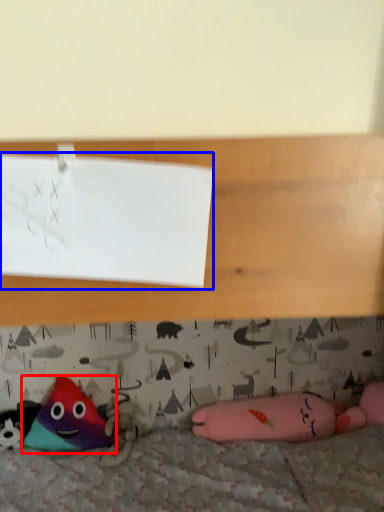
Question: Which object appears farthest to the camera in this image, toy (highlighted by a red box) or paper (highlighted by a blue box)?

Choices:
 (A) toy
 (B) paper

Answer: (A)